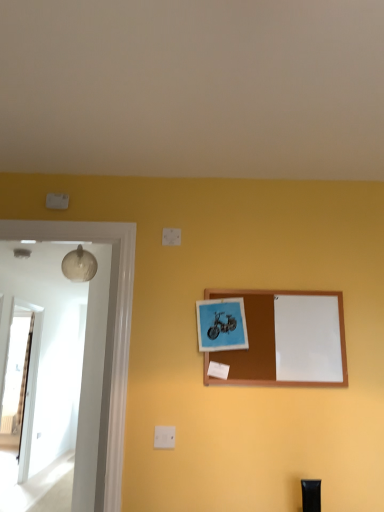
Question: Is matte blue picture frame at center, the 2th picture frame when ordered from right to left, at the left side of transparent glass door at left?

Choices:
 (A) no
 (B) yes

Answer: (A)

Question: Considering the relative sizes of matte blue picture frame at center, which is the 1th picture frame from left to right, and transparent glass door at left in the image provided, is matte blue picture frame at center, which is the 1th picture frame from left to right, smaller than transparent glass door at left?

Choices:
 (A) no
 (B) yes

Answer: (B)

Question: Is matte blue picture frame at center, which is the 1th picture frame from left to right, outside transparent glass door at left?

Choices:
 (A) no
 (B) yes

Answer: (B)

Question: From a real-world perspective, is matte blue picture frame at center, the 2th picture frame when ordered from right to left, under transparent glass door at left?

Choices:
 (A) no
 (B) yes

Answer: (A)

Question: From a real-world perspective, is matte blue picture frame at center, the 2th picture frame when ordered from right to left, located higher than transparent glass door at left?

Choices:
 (A) no
 (B) yes

Answer: (B)

Question: Is matte blue picture frame at center, the 2th picture frame when ordered from right to left, thinner than transparent glass door at left?

Choices:
 (A) no
 (B) yes

Answer: (B)

Question: Is transparent glass door at left behind wooden corkboard at center, the 2th picture frame in the left-to-right sequence?

Choices:
 (A) yes
 (B) no

Answer: (A)

Question: From a real-world perspective, is transparent glass door at left on wooden corkboard at center, the 2th picture frame in the left-to-right sequence?

Choices:
 (A) yes
 (B) no

Answer: (B)

Question: Considering the relative sizes of transparent glass door at left and wooden corkboard at center, the 2th picture frame in the left-to-right sequence, in the image provided, is transparent glass door at left bigger than wooden corkboard at center, the 2th picture frame in the left-to-right sequence,?

Choices:
 (A) yes
 (B) no

Answer: (A)

Question: Is transparent glass door at left not inside wooden corkboard at center, the 2th picture frame in the left-to-right sequence?

Choices:
 (A) yes
 (B) no

Answer: (A)

Question: Is transparent glass door at left next to wooden corkboard at center, which ranks as the 1th picture frame in right-to-left order?

Choices:
 (A) no
 (B) yes

Answer: (A)

Question: Is transparent glass door at left turned away from wooden corkboard at center, which ranks as the 1th picture frame in right-to-left order?

Choices:
 (A) no
 (B) yes

Answer: (A)

Question: Considering the relative sizes of wooden corkboard at center, the 2th picture frame in the left-to-right sequence, and transparent glass door at left in the image provided, is wooden corkboard at center, the 2th picture frame in the left-to-right sequence, wider than transparent glass door at left?

Choices:
 (A) yes
 (B) no

Answer: (B)